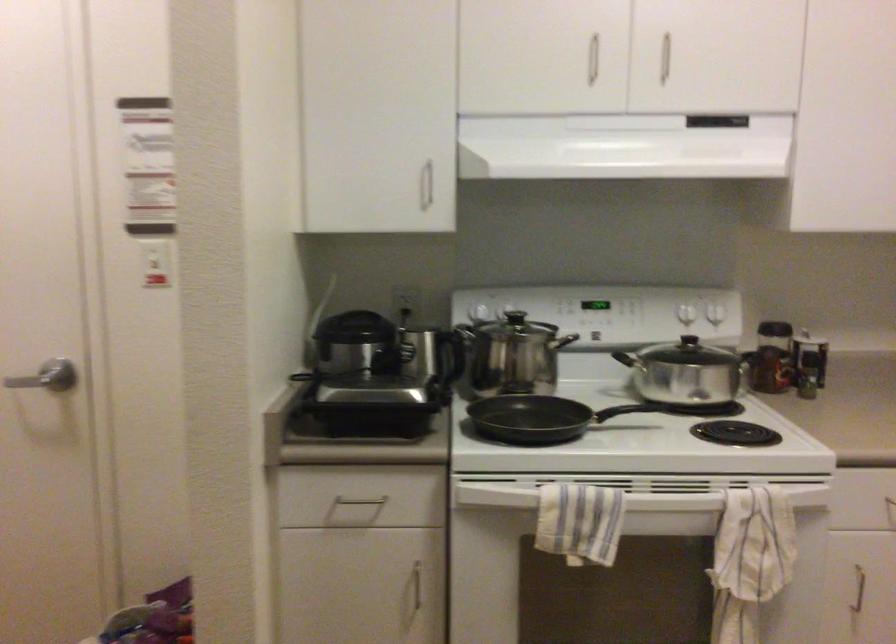
Image resolution: width=896 pixels, height=644 pixels. Describe the element at coordinates (623, 411) in the screenshot. I see `the black pan handle` at that location.